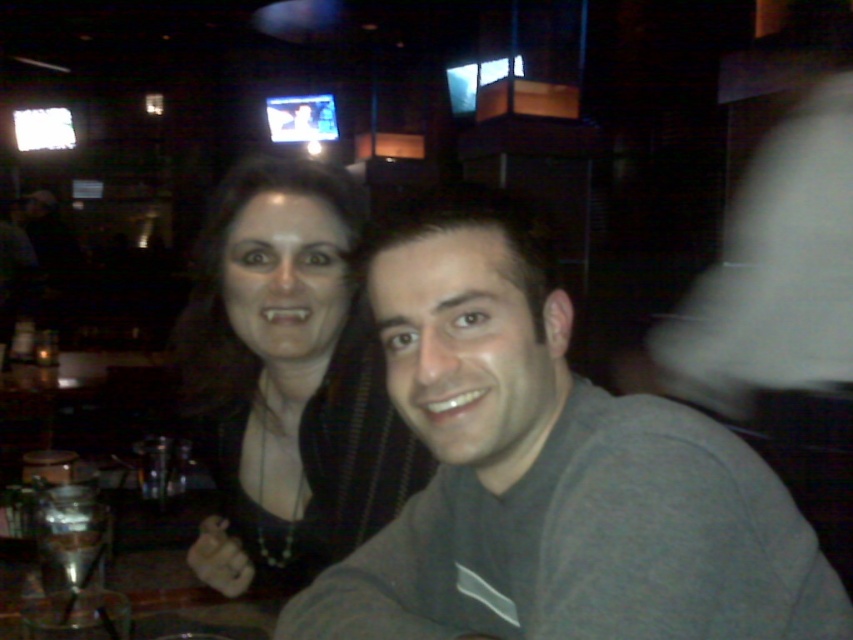
Which is above, gray matte shirt at center or matte black hair at center?

matte black hair at center is higher up.

You are a GUI agent. You are given a task and a screenshot of the screen. Output one action in this format:
    pyautogui.click(x=<x>, y=<y>)
    Task: Click on the gray matte shirt at center
    This screenshot has width=853, height=640.
    Given the screenshot: What is the action you would take?
    pyautogui.click(x=550, y=472)